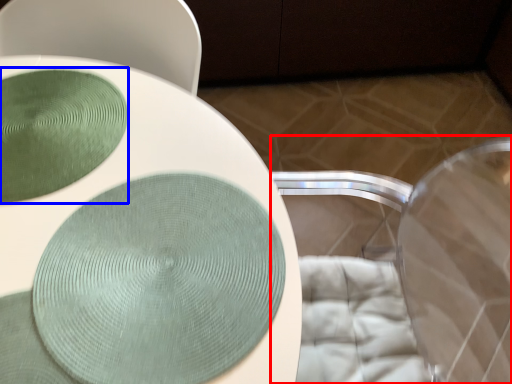
Question: Which of the following is the closest to the observer, swivel chair (highlighted by a red box) or glass plate (highlighted by a blue box)?

Choices:
 (A) swivel chair
 (B) glass plate

Answer: (A)